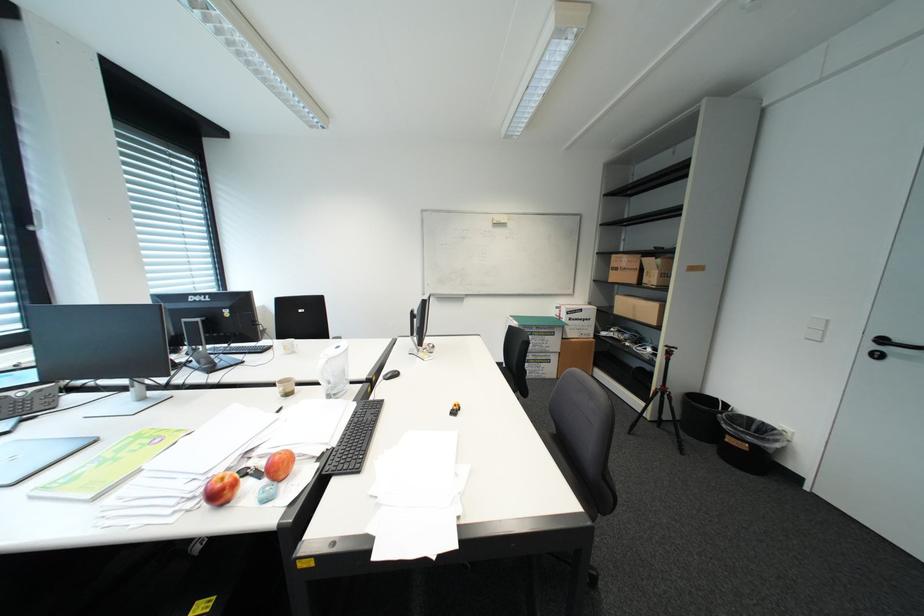
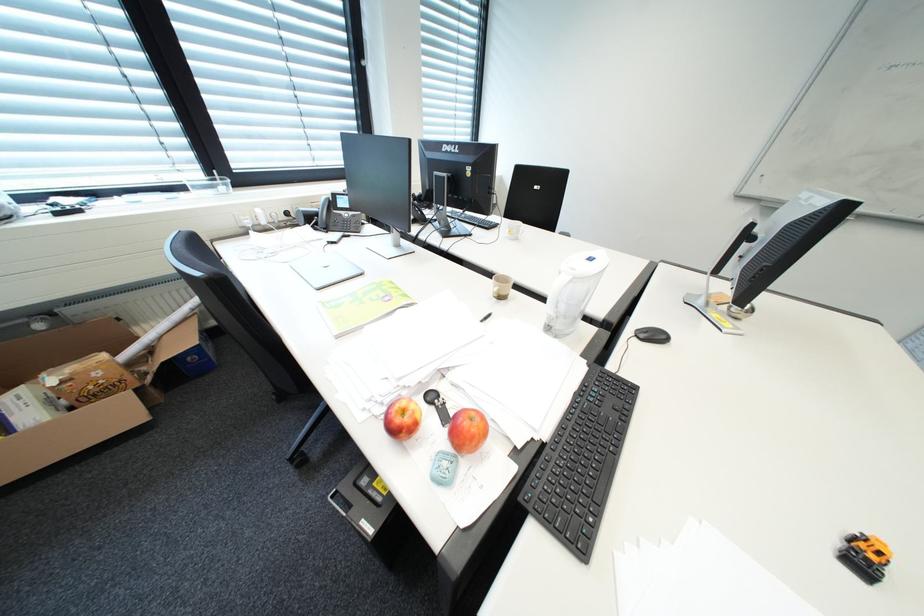
The images are taken continuously from a first-person perspective. In which direction is your viewpoint rotating?

The rotation direction of the camera is left-down.